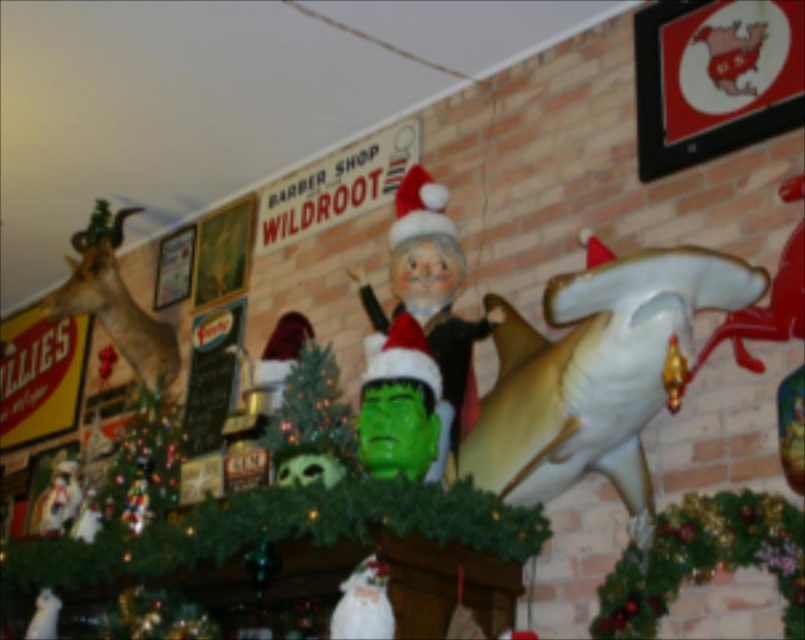
Question: Estimate the real-world distances between objects in this image. Which object is farther from the white glossy shark at right?

Choices:
 (A) shiny green ornament at left
 (B) shiny gold deer at upper left
 (C) green matte christmas tree at center
 (D) matte plastic santa at center

Answer: (B)

Question: In this image, where is green matte christmas tree at center located relative to shiny green ornament at left?

Choices:
 (A) left
 (B) right

Answer: (B)

Question: Which of the following is the farthest from the observer?

Choices:
 (A) matte plastic santa at center
 (B) green matte wreath at lower right
 (C) green matte christmas tree at center

Answer: (A)

Question: Considering the real-world distances, which object is farthest from the green matte christmas tree at center?

Choices:
 (A) white glossy shark at right
 (B) matte plastic santa at center
 (C) green matte wreath at lower right
 (D) shiny gold deer at upper left

Answer: (D)

Question: Can you confirm if matte plastic santa at center is smaller than shiny gold deer at upper left?

Choices:
 (A) no
 (B) yes

Answer: (B)

Question: Can you confirm if green matte wreath at lower right is positioned below shiny green ornament at left?

Choices:
 (A) no
 (B) yes

Answer: (B)